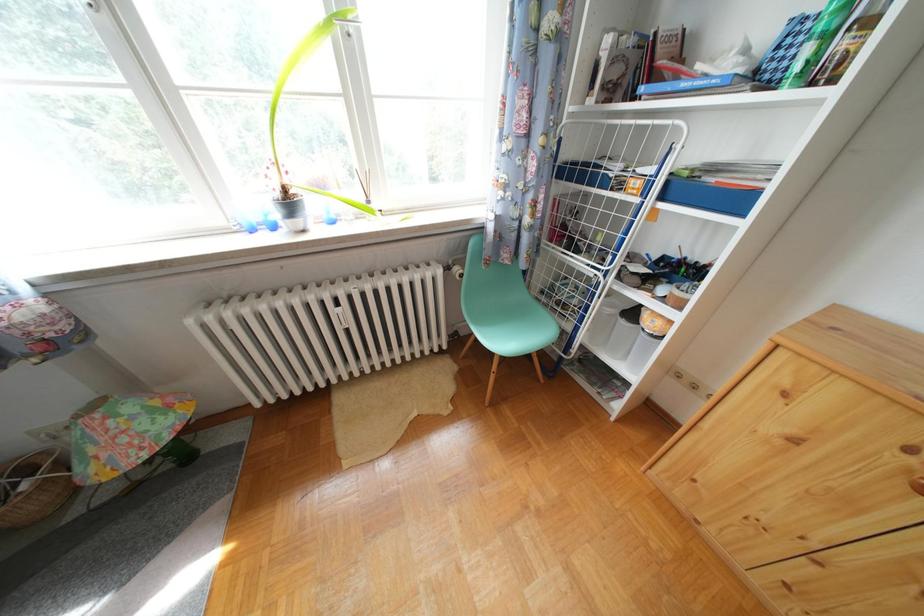
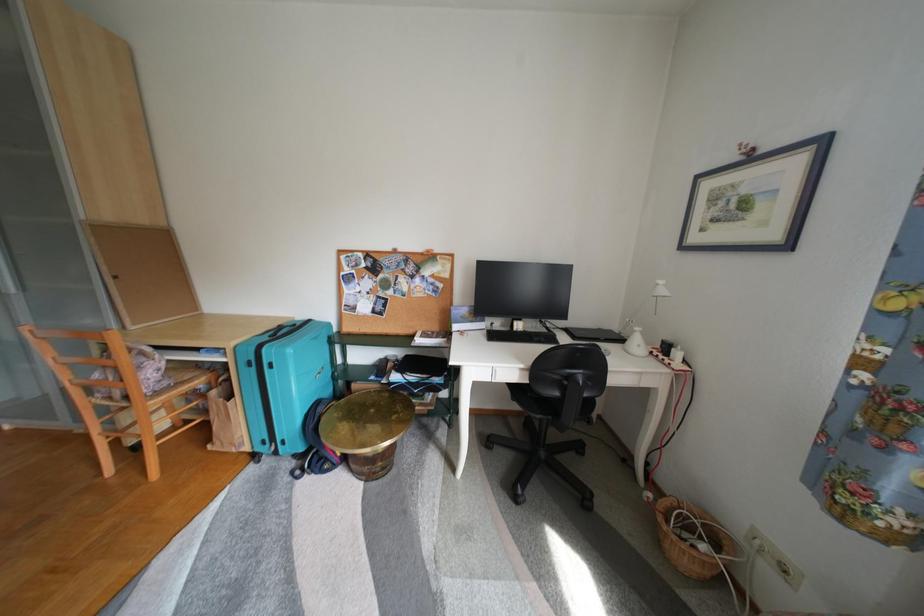
First-person continuous shooting, in which direction is the camera rotating?

The camera's rotation is toward left-down.